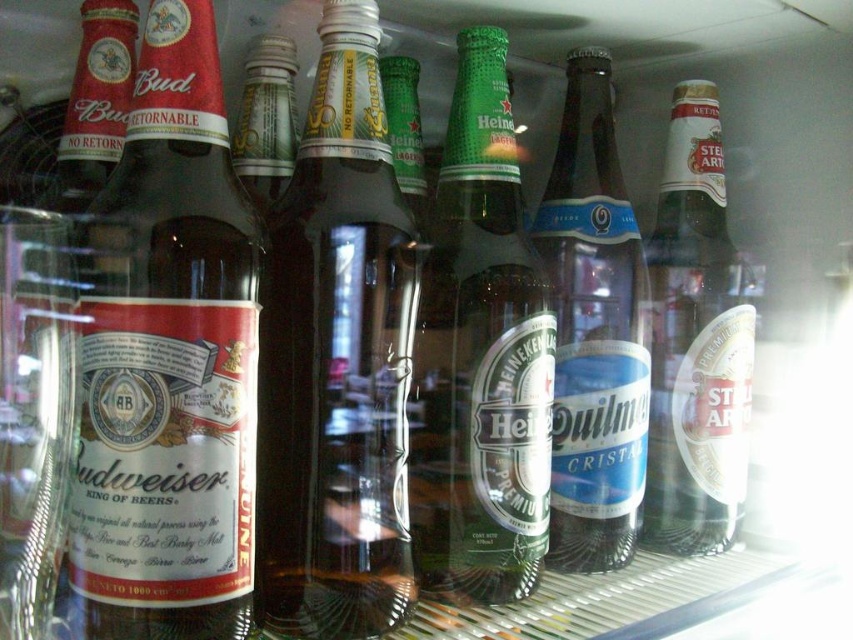
Question: Which point appears closest to the camera in this image?

Choices:
 (A) (102, 353)
 (B) (544, 204)

Answer: (A)

Question: Is matte glass bottle at left behind brown glass bottle at center?

Choices:
 (A) no
 (B) yes

Answer: (A)

Question: Based on their relative distances, which object is nearer to the blue glass bottle at center?

Choices:
 (A) clear glass bottle at right
 (B) green glass bottle at center

Answer: (A)

Question: Can you confirm if matte glass bottle at left is positioned to the right of clear glass bottle at right?

Choices:
 (A) yes
 (B) no

Answer: (B)

Question: Is green glass bottle at center closer to camera compared to clear glass bottle at right?

Choices:
 (A) yes
 (B) no

Answer: (A)

Question: Which of the following is the closest to the observer?

Choices:
 (A) brown glass bottle at center
 (B) blue glass bottle at center

Answer: (A)